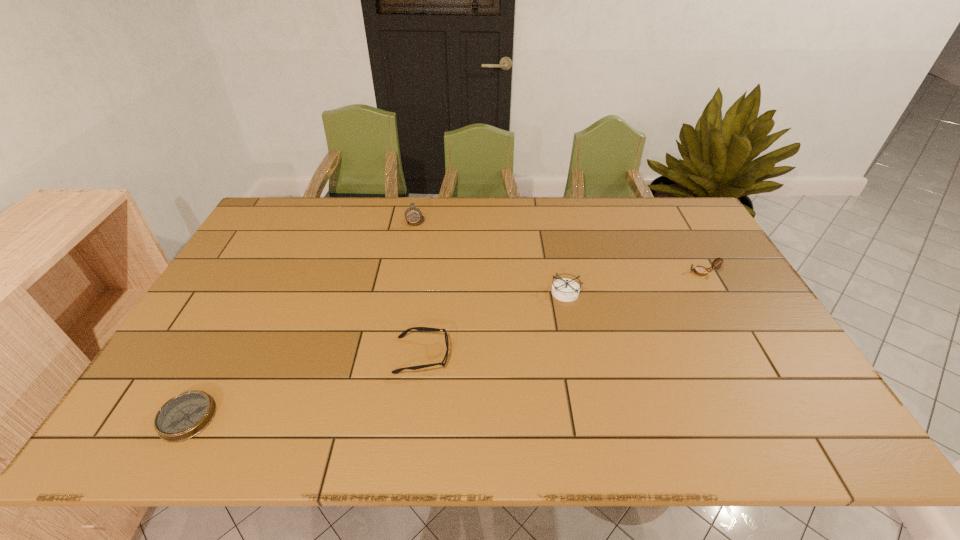
The image size is (960, 540). I want to click on the third compass from right to left, so click(414, 217).

The width and height of the screenshot is (960, 540). I want to click on the farthest compass, so click(414, 217).

Where is `the third farthest object`? the third farthest object is located at coordinates (566, 290).

The width and height of the screenshot is (960, 540). In order to click on the third farthest compass in this screenshot , I will do `click(566, 290)`.

Find the location of a particular element. Image resolution: width=960 pixels, height=540 pixels. the rightmost compass is located at coordinates (700, 270).

Identify the location of the fourth nearest object. This screenshot has width=960, height=540. (700, 270).

This screenshot has height=540, width=960. Find the location of `the second nearest object`. the second nearest object is located at coordinates (405, 332).

Image resolution: width=960 pixels, height=540 pixels. Find the location of `the second shortest object`. the second shortest object is located at coordinates (405, 332).

You are a GUI agent. You are given a task and a screenshot of the screen. Output one action in this format:
    pyautogui.click(x=<x>, y=<y>)
    Task: Click on the shortest object
    This screenshot has height=540, width=960.
    Given the screenshot: What is the action you would take?
    pyautogui.click(x=182, y=417)

In order to click on the leftmost object in this screenshot , I will do `click(182, 417)`.